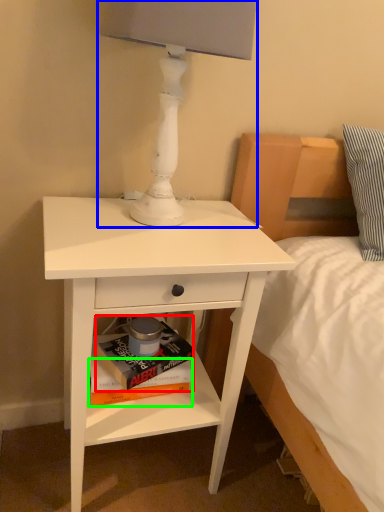
Question: Which is farther away from paperback book (highlighted by a red box)? table lamp (highlighted by a blue box) or paperback book (highlighted by a green box)?

Choices:
 (A) table lamp
 (B) paperback book

Answer: (A)